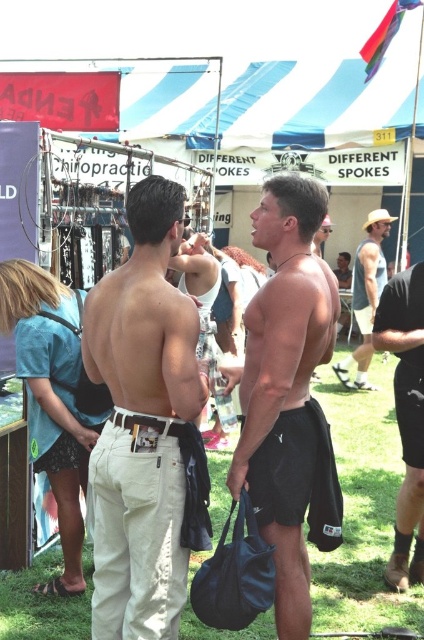
Question: Which of the following is the farthest from the observer?

Choices:
 (A) black leather boots at lower right
 (B) denim shorts at lower left

Answer: (A)

Question: Is tan cotton pants at center smaller than denim shorts at lower left?

Choices:
 (A) no
 (B) yes

Answer: (B)

Question: Is black matte shorts at center above denim shorts at lower left?

Choices:
 (A) yes
 (B) no

Answer: (A)

Question: Among these objects, which one is nearest to the camera?

Choices:
 (A) black matte shorts at center
 (B) tan cotton pants at center
 (C) tan leather hat at right

Answer: (B)

Question: Is tan cotton pants at center above black matte shorts at center?

Choices:
 (A) yes
 (B) no

Answer: (B)

Question: Among these points, which one is farthest from the camera?

Choices:
 (A) (145, 208)
 (B) (262, 288)
 (C) (399, 300)
 (D) (365, 243)

Answer: (D)